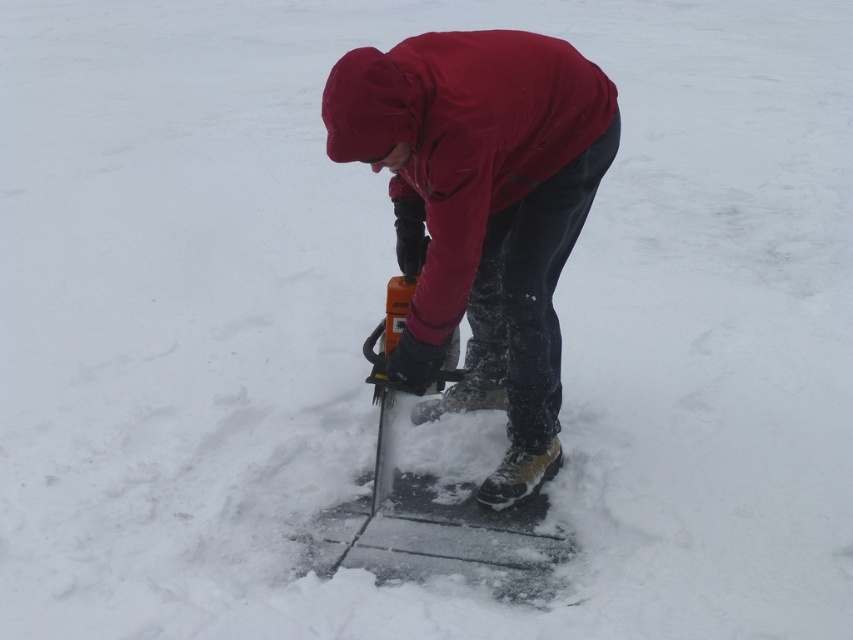
Based on the photo, is matte red jacket at center to the left of orange plastic saw at center from the viewer's perspective?

No, matte red jacket at center is not to the left of orange plastic saw at center.

Who is more distant from viewer, (473, 269) or (537, 513)?

The point (537, 513) is more distant.

The image size is (853, 640). Find the location of `matte red jacket at center`. matte red jacket at center is located at coordinates click(482, 211).